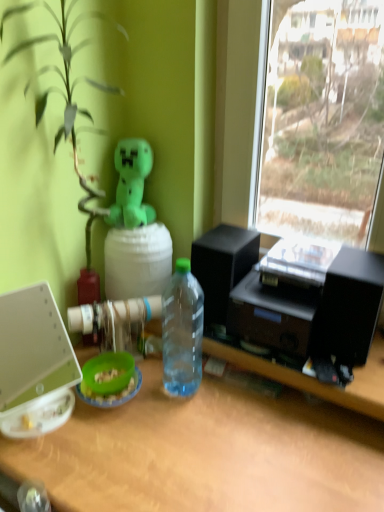
Question: Would you say white plastic laptop at left is inside or outside transparent plastic bottle at center?

Choices:
 (A) outside
 (B) inside

Answer: (A)

Question: From a real-world perspective, is white plastic laptop at left physically located above or below transparent plastic bottle at center?

Choices:
 (A) below
 (B) above

Answer: (A)

Question: Which object is the farthest from the white plastic laptop at left?

Choices:
 (A) green plush toy at upper center
 (B) transparent plastic bottle at center

Answer: (A)

Question: Considering the real-world distances, which object is farthest from the white plastic laptop at left?

Choices:
 (A) transparent plastic bottle at center
 (B) green plush toy at upper center

Answer: (B)